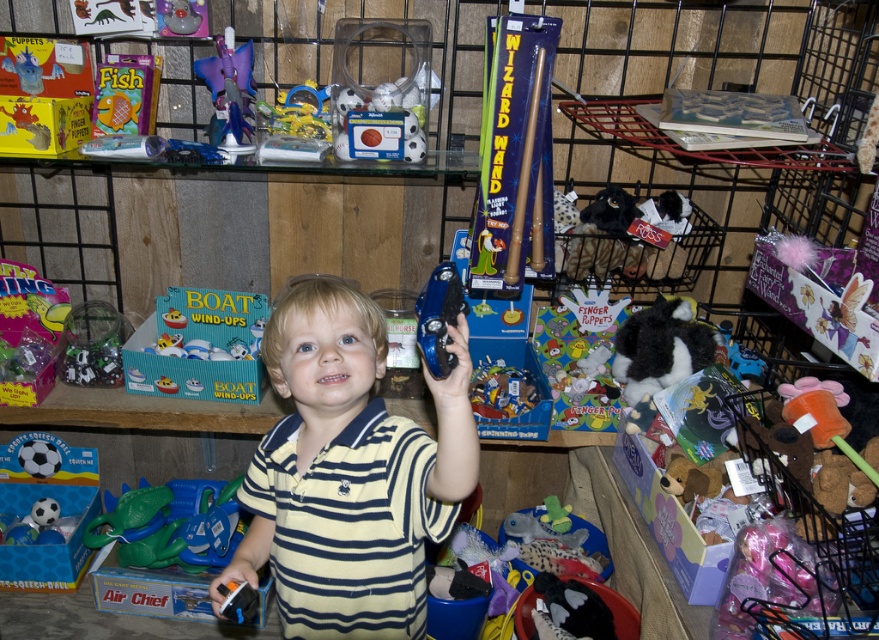
You are a parent looking to buy a musical toy for your child. You see the fuzzy fabric stuffed animal at lower right and the blue plastic tambourine at upper center. Which one would you choose if you want the smaller option?

The blue plastic tambourine at upper center is smaller in size than the fuzzy fabric stuffed animal at lower right, so you should choose the blue plastic tambourine at upper center if you want the smaller option.

You are a customer in the toy store looking at the purple plastic star at upper left and the yellow striped shirt at center. From your perspective, which object is positioned to the left?

The purple plastic star at upper left is positioned to the left of the yellow striped shirt at center.